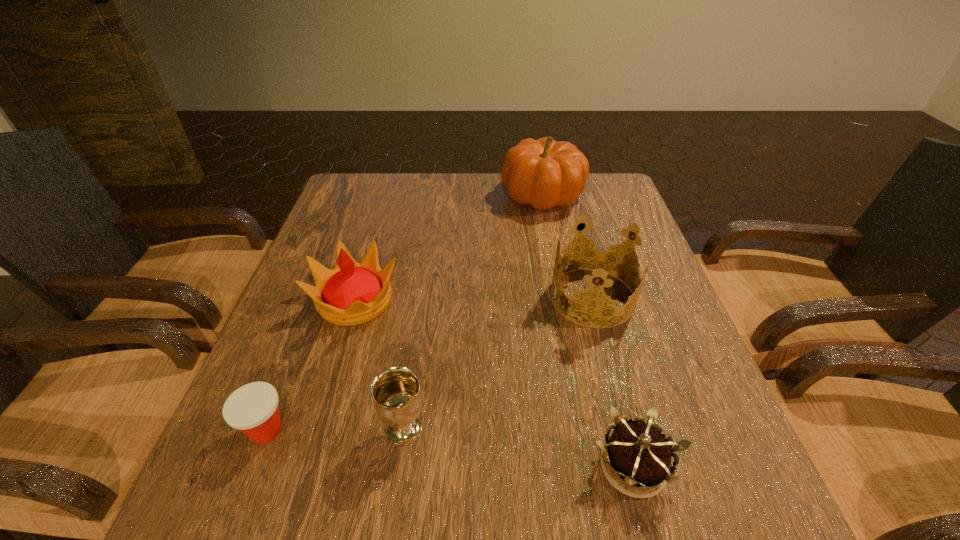
This screenshot has height=540, width=960. Identify the location of pumpkin. (544, 173).

Where is `the leftmost crown`? The height and width of the screenshot is (540, 960). the leftmost crown is located at coordinates (352, 293).

I want to click on chalice, so click(398, 401).

Identify the location of the third shortest object. This screenshot has height=540, width=960. (398, 401).

Where is `the shortest crown`? The width and height of the screenshot is (960, 540). the shortest crown is located at coordinates (635, 453).

Find the location of a particular element. Dixie cup is located at coordinates (253, 409).

In order to click on free space located 0.350m on the front of the farthest object in this screenshot , I will do `click(564, 309)`.

What are the coordinates of `free space located 0.070m on the right of the leftmost crown` in the screenshot? It's located at (429, 300).

The width and height of the screenshot is (960, 540). What are the coordinates of `free space located on the left of the fourth tallest object` in the screenshot? It's located at (251, 429).

Find the location of a particular element. This screenshot has height=540, width=960. free region located 0.190m on the back of the nearest crown is located at coordinates (601, 345).